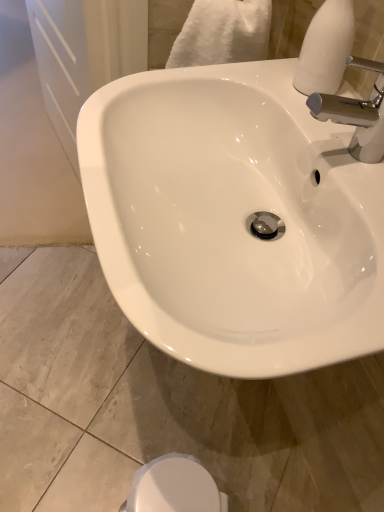
What are the coordinates of `free spot to the left of white matte soap dispenser at upper right` in the screenshot? It's located at (237, 79).